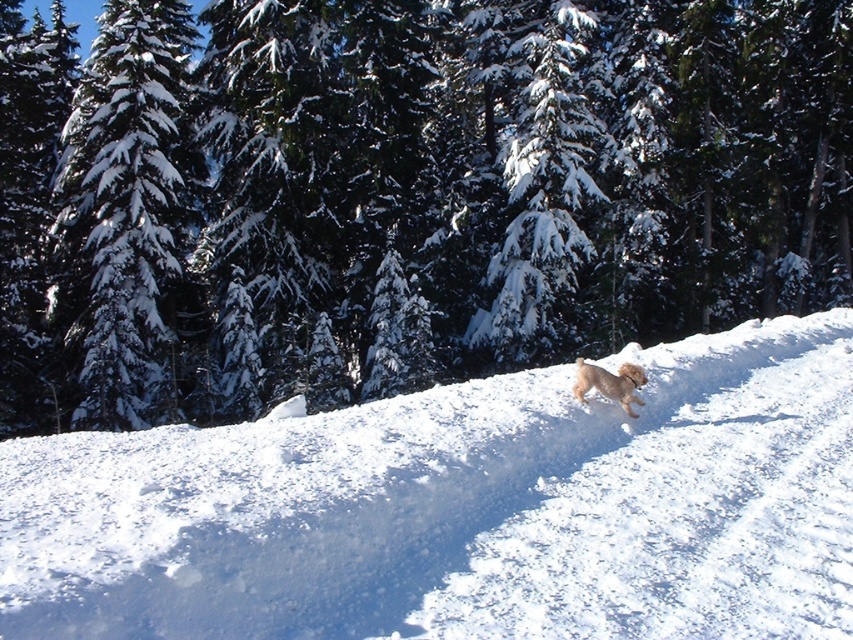
Which is above, green snow-covered tree at upper left or fuzzy golden dog at center?

Positioned higher is green snow-covered tree at upper left.

You are a GUI agent. You are given a task and a screenshot of the screen. Output one action in this format:
    pyautogui.click(x=<x>, y=<y>)
    Task: Click on the green snow-covered tree at upper left
    The image size is (853, 640).
    Given the screenshot: What is the action you would take?
    pyautogui.click(x=125, y=209)

You are a GUI agent. You are given a task and a screenshot of the screen. Output one action in this format:
    pyautogui.click(x=<x>, y=<y>)
    Task: Click on the green snow-covered tree at upper left
    The image size is (853, 640).
    Given the screenshot: What is the action you would take?
    pyautogui.click(x=125, y=209)

Between white fluffy snow at center and fuzzy golden dog at center, which one is positioned higher?

fuzzy golden dog at center

Is white fluffy snow at center smaller than fuzzy golden dog at center?

Actually, white fluffy snow at center might be larger than fuzzy golden dog at center.

At what (x,y) coordinates should I click in order to perform the action: click on white fluffy snow at center. Please return your answer as a coordinate pair (x, y). Looking at the image, I should click on 463,508.

The height and width of the screenshot is (640, 853). Identify the location of white fluffy snow at center. (463, 508).

Between green matte tree at upper center and fuzzy golden dog at center, which one is positioned lower?

fuzzy golden dog at center

Does point (329, 29) come closer to viewer compared to point (613, 380)?

No, (329, 29) is behind (613, 380).

The height and width of the screenshot is (640, 853). I want to click on green matte tree at upper center, so click(x=401, y=193).